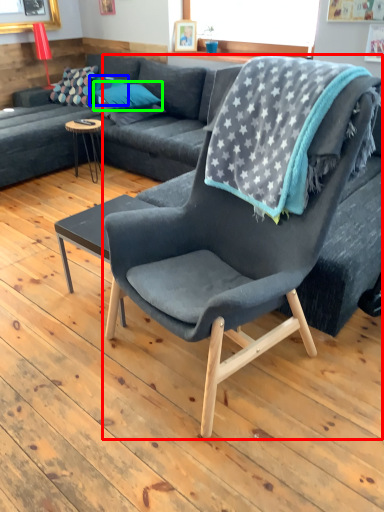
Question: Based on their relative distances, which object is nearer to chair (highlighted by a red box)? Choose from pillow (highlighted by a blue box) and pillow (highlighted by a green box).

Choices:
 (A) pillow
 (B) pillow

Answer: (B)